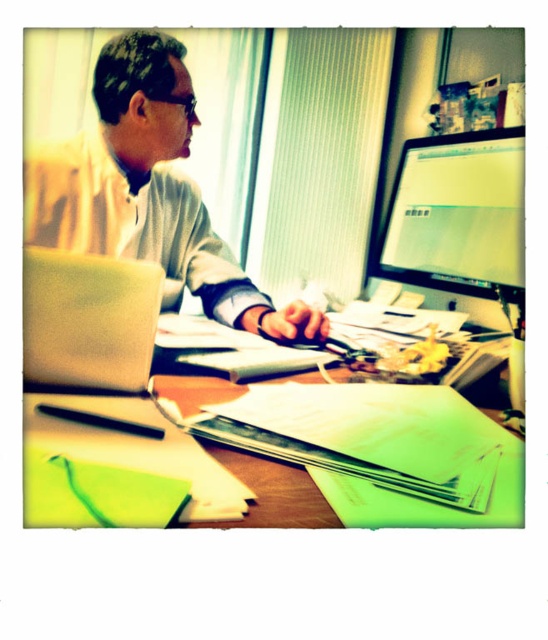
Between point (77, 444) and point (95, 413), which one is positioned in front?

Positioned in front is point (77, 444).

The image size is (548, 640). What are the coordinates of `wooden desk at center` in the screenshot? It's located at (378, 444).

Find the location of a particular element. Image resolution: width=548 pixels, height=640 pixels. wooden desk at center is located at coordinates (378, 444).

Is wooden desk at center shorter than black plastic glasses at upper center?

Incorrect, wooden desk at center's height does not fall short of black plastic glasses at upper center's.

Identify the location of wooden desk at center. (378, 444).

This screenshot has height=640, width=548. I want to click on wooden desk at center, so click(378, 444).

Is point (37, 259) more distant than point (145, 422)?

Yes, it is behind point (145, 422).

What do you see at coordinates (88, 323) in the screenshot?
I see `matte green laptop at left` at bounding box center [88, 323].

This screenshot has height=640, width=548. What are the coordinates of `matte green laptop at left` in the screenshot? It's located at [x=88, y=323].